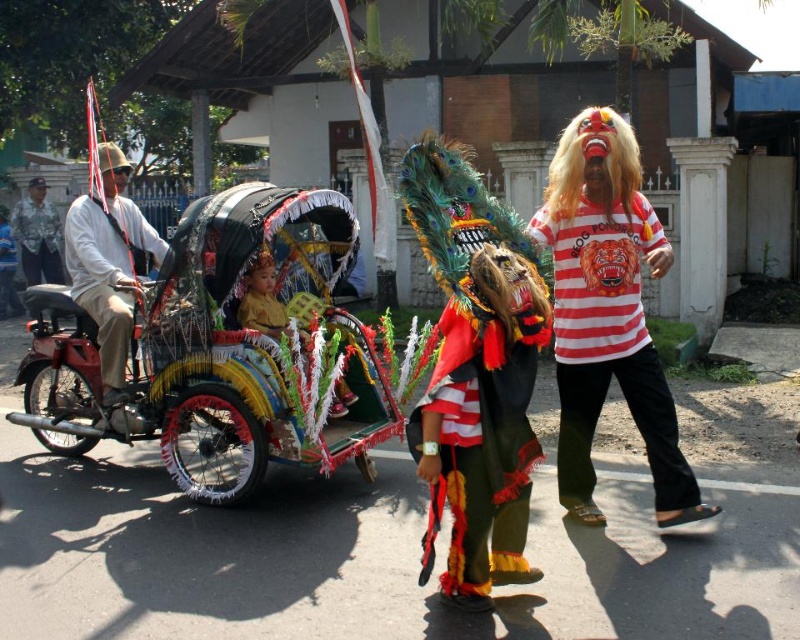
Looking at this image, you are a photographer trying to capture the festive scene. You want to ensure both the decorative painted cart at center and the striped cotton shirt at center are visible in your photo. Based on their positions, which one should you focus on first to frame them properly?

The decorative painted cart at center is below the striped cotton shirt at center, so you should focus on the striped cotton shirt at center first to ensure both are in frame.

You are a photographer trying to capture the vibrant street scene. You notice the striped cotton shirt at center and the light brown leather jacket at left. Which one is positioned more to the right side of the scene?

The striped cotton shirt at center is positioned more to the right side of the scene than the light brown leather jacket at left.

You are a street vendor trying to set up a stall between the decorative painted cart at center and the striped cotton shirt at center. The stall requires a minimum of 1.2 meters of space. Can you determine if there is enough space between them based on their sizes?

The decorative painted cart at center is wider than the striped cotton shirt at center, but the exact distance between them isn